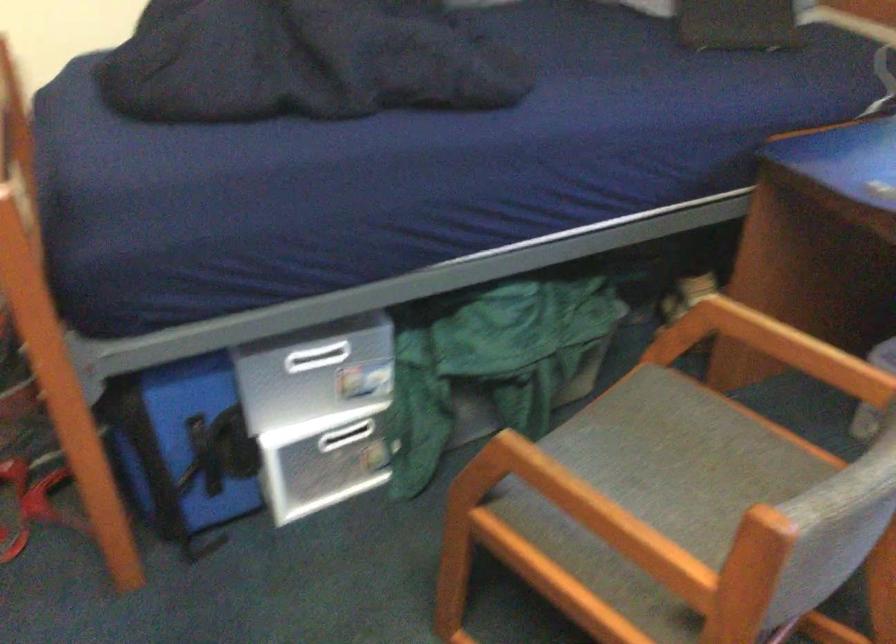
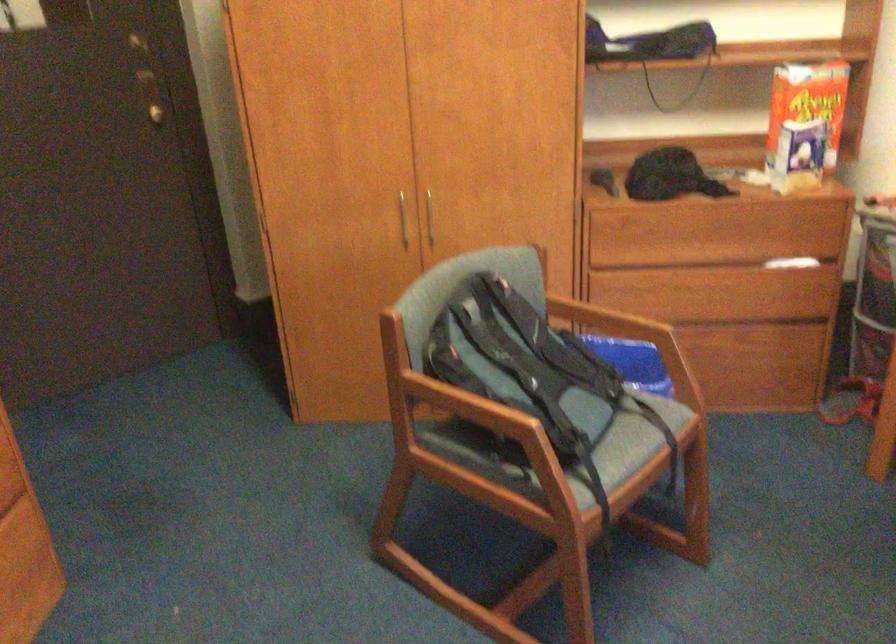
Question: The camera is either moving clockwise (left) or counter-clockwise (right) around the object. The first image is from the beginning of the video and the second image is from the end. Is the camera moving left or right when shooting the video?

Choices:
 (A) Left
 (B) Right

Answer: (B)